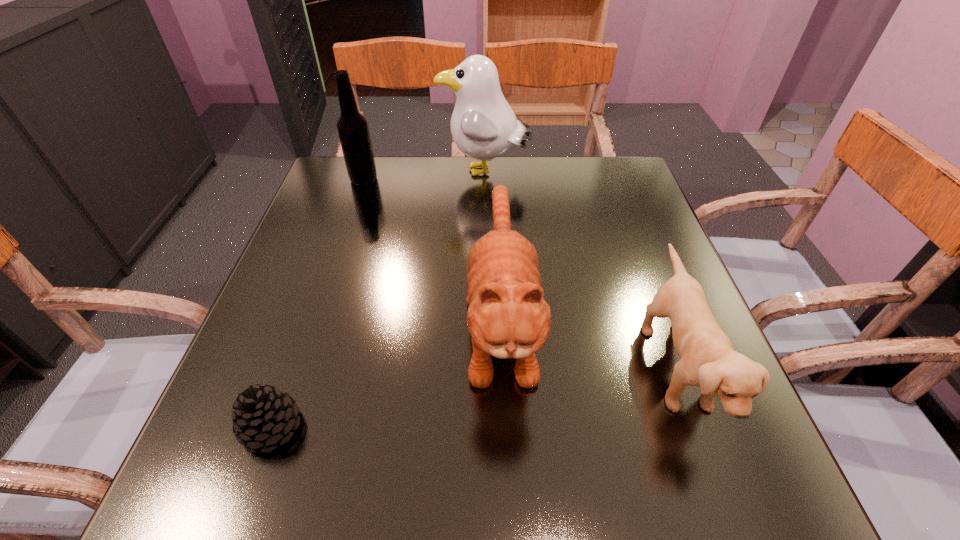
This screenshot has height=540, width=960. Find the location of `vacant space located 0.240m on the left side of the puppy`. vacant space located 0.240m on the left side of the puppy is located at coordinates (510, 367).

I want to click on free point located 0.300m on the left side of the puppy, so click(475, 367).

Locate an element on the screen. The image size is (960, 540). vacant space located on the left side of the puppy is located at coordinates (504, 367).

Identify the location of free region located at the narrow end of the pinecone. 546,427.

The height and width of the screenshot is (540, 960). I want to click on gull located in the far edge section of the desktop, so coord(483,125).

Where is `beer bottle positioned at the far edge`? beer bottle positioned at the far edge is located at coordinates (353, 130).

The height and width of the screenshot is (540, 960). I want to click on puppy present at the near edge, so click(x=708, y=359).

Find the location of a particular element. Image resolution: width=960 pixels, height=540 pixels. pinecone at the near edge is located at coordinates (264, 415).

The image size is (960, 540). I want to click on beer bottle that is at the left edge, so click(353, 130).

You are a GUI agent. You are given a task and a screenshot of the screen. Output one action in this format:
    pyautogui.click(x=<x>, y=<y>)
    Task: Click on the pinecone that is positioned at the left edge
    The image size is (960, 540).
    Given the screenshot: What is the action you would take?
    pyautogui.click(x=264, y=415)